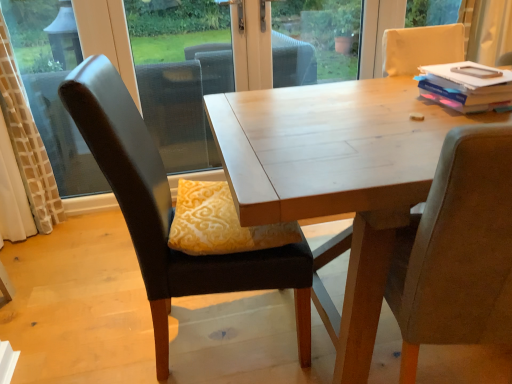
Find the location of a particular element. blank area beneath matte black chair at left, the second chair when ordered from right to left (from a real-world perspective) is located at coordinates (198, 337).